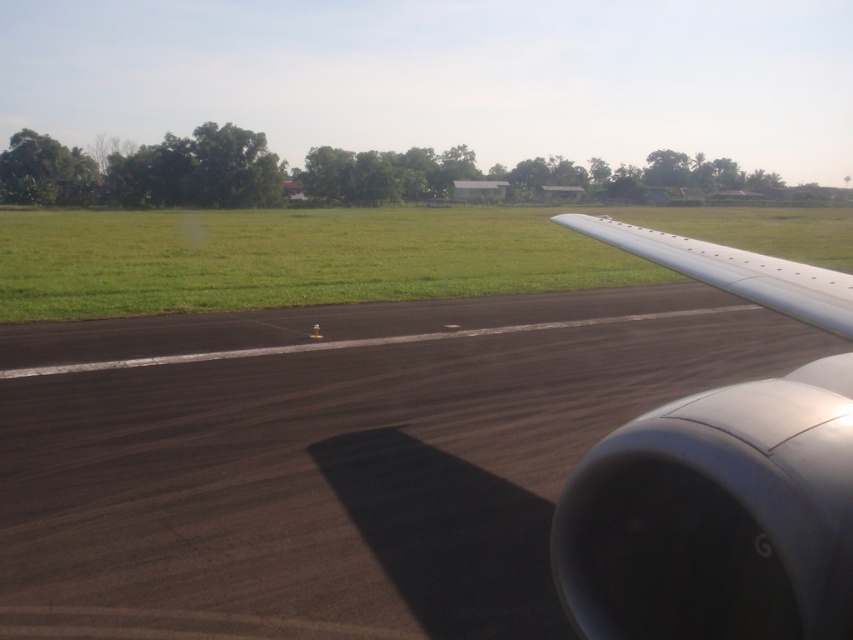
Question: Which object appears farthest from the camera in this image?

Choices:
 (A) black asphalt runway at center
 (B) green grass at center

Answer: (B)

Question: Is metallic gray wing at right behind green grass at center?

Choices:
 (A) no
 (B) yes

Answer: (A)

Question: Does green grass at center appear on the left side of silver metallic wing at right?

Choices:
 (A) no
 (B) yes

Answer: (B)

Question: Which object is positioned closest to the green grass at center?

Choices:
 (A) black asphalt runway at center
 (B) metallic gray wing at right
 (C) silver metallic wing at right

Answer: (A)

Question: Considering the real-world distances, which object is closest to the silver metallic wing at right?

Choices:
 (A) green grass at center
 (B) black asphalt runway at center

Answer: (B)

Question: Is black asphalt runway at center positioned behind green grass at center?

Choices:
 (A) yes
 (B) no

Answer: (B)